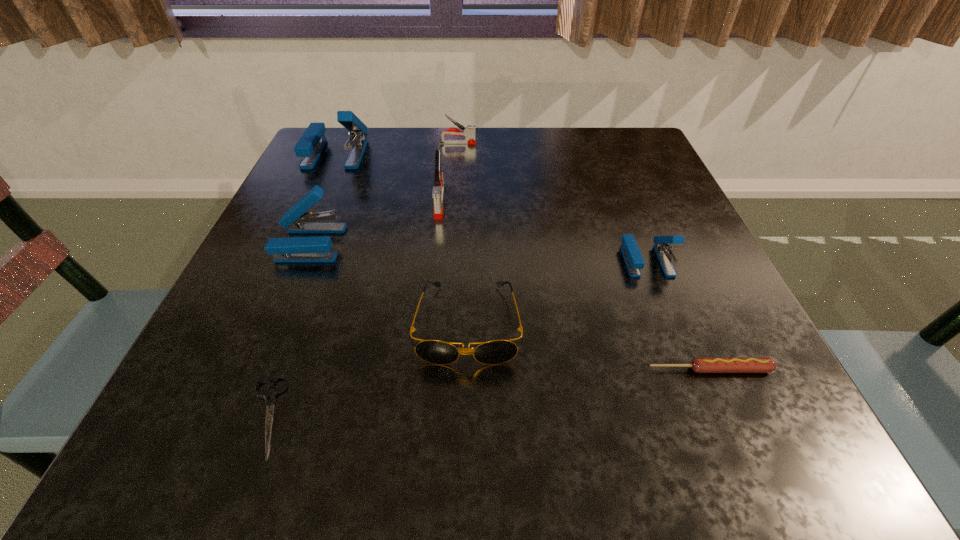
At what (x,y) coordinates should I click in order to perform the action: click on free space between the biggest blue stapler and the smaller gray stapler. Please return your answer as a coordinate pair (x, y). The width and height of the screenshot is (960, 540). Looking at the image, I should click on pos(396,148).

Find the location of a particular element. vacant area that lies between the sunglasses and the bigger gray stapler is located at coordinates (454, 262).

You are a GUI agent. You are given a task and a screenshot of the screen. Output one action in this format:
    pyautogui.click(x=<x>, y=<y>)
    Task: Click on the blank region between the biggest blue stapler and the third nearest stapler
    
    Given the screenshot: What is the action you would take?
    pyautogui.click(x=388, y=178)

This screenshot has height=540, width=960. I want to click on empty location between the farther gray stapler and the second biggest blue stapler, so click(384, 193).

This screenshot has width=960, height=540. Find the location of `object that stands as the closest to the sausage`. object that stands as the closest to the sausage is located at coordinates (634, 261).

Locate which object is the fourth closest to the farthest blue stapler. Please provide its 2D coordinates. Your answer should be formatted as a tuple, i.e. [(x, y)], where the tuple contains the x and y coordinates of a point satisfying the conditions above.

[(493, 352)]

Locate an element on the screen. The width and height of the screenshot is (960, 540). stapler that can be found as the third closest to the black sunglasses is located at coordinates (634, 261).

Choose which stapler is the second nearest neighbor to the sixth tallest object. Please provide its 2D coordinates. Your answer should be formatted as a tuple, i.e. [(x, y)], where the tuple contains the x and y coordinates of a point satisfying the conditions above.

[(438, 191)]

Locate an element on the screen. The width and height of the screenshot is (960, 540). blue stapler object that ranks as the second closest to the farthest blue stapler is located at coordinates (634, 261).

Select which blue stapler appears as the second closest to the farther gray stapler. Please provide its 2D coordinates. Your answer should be formatted as a tuple, i.e. [(x, y)], where the tuple contains the x and y coordinates of a point satisfying the conditions above.

[(293, 249)]